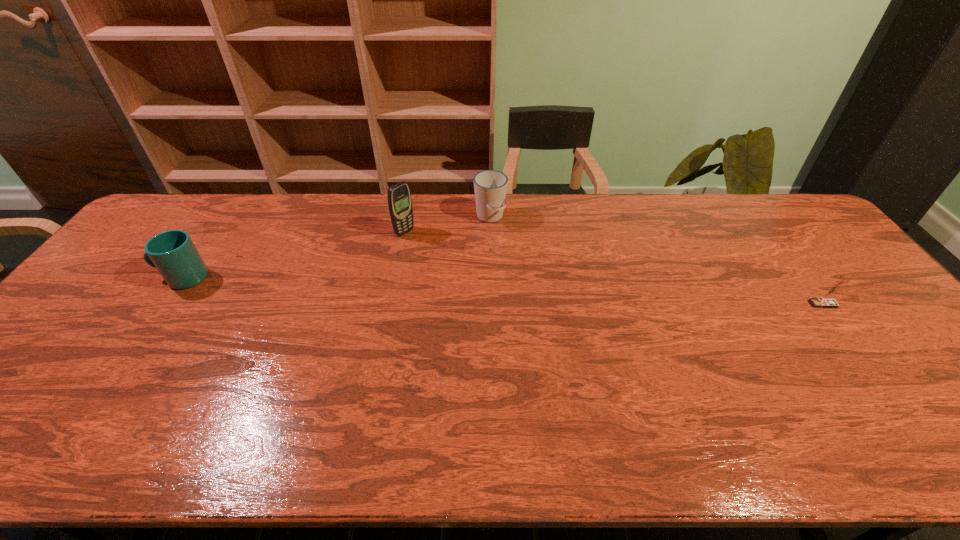
The height and width of the screenshot is (540, 960). In order to click on free space on the desktop that is between the leftmost object and the rightmost object and is positioned on the screen of the cellular telephone in this screenshot , I will do `click(489, 290)`.

Where is `vacant space on the desktop that is between the leftmost object and the rightmost object and is positioned with a handle on the side of the right cup`? This screenshot has width=960, height=540. vacant space on the desktop that is between the leftmost object and the rightmost object and is positioned with a handle on the side of the right cup is located at coordinates (537, 292).